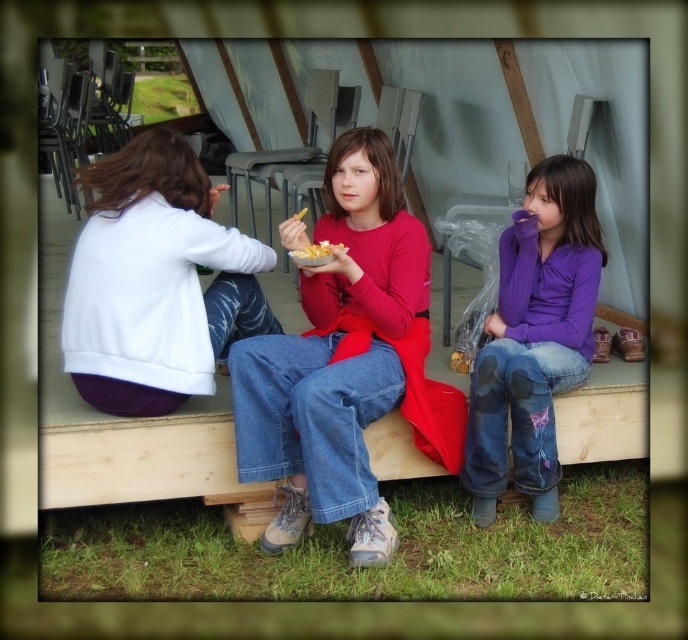
Question: Which object appears farthest from the camera in this image?

Choices:
 (A) denim jeans at center
 (B) yellow crispy snack at center

Answer: (B)

Question: Can you confirm if purple soft fabric shirt at center is wider than yellow crispy snack at center?

Choices:
 (A) yes
 (B) no

Answer: (A)

Question: Which point appears farthest from the camera in this image?

Choices:
 (A) (292, 348)
 (B) (557, 252)

Answer: (B)

Question: Does purple soft fabric shirt at center appear on the left side of yellow crispy snack at center?

Choices:
 (A) yes
 (B) no

Answer: (B)

Question: Estimate the real-world distances between objects in this image. Which object is farther from the white matte sweatshirt at left?

Choices:
 (A) yellow crispy snack at center
 (B) denim jeans at center
 (C) purple soft fabric shirt at center

Answer: (C)

Question: Does white matte sweatshirt at left come in front of purple soft fabric shirt at center?

Choices:
 (A) no
 (B) yes

Answer: (B)